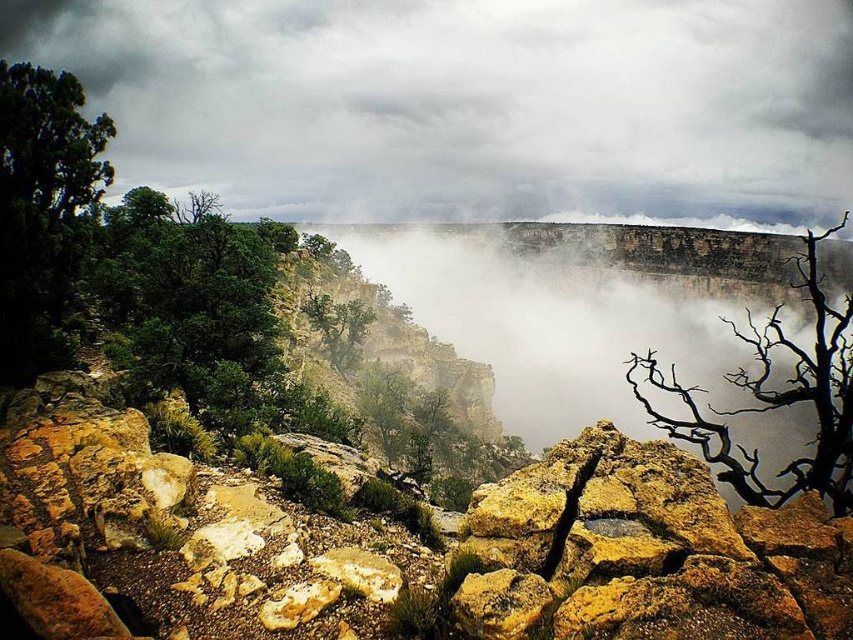
Question: Is foggy mist at center above green leafy tree at left?

Choices:
 (A) yes
 (B) no

Answer: (B)

Question: Observing the image, what is the correct spatial positioning of cloudy sky at upper center in reference to green leafy tree at left?

Choices:
 (A) below
 (B) above

Answer: (B)

Question: Based on their relative distances, which object is farther from the cloudy sky at upper center?

Choices:
 (A) green leafy tree at left
 (B) black deadwood at right

Answer: (B)

Question: Does foggy mist at center appear over black deadwood at right?

Choices:
 (A) no
 (B) yes

Answer: (B)

Question: Which point is closer to the camera taking this photo?

Choices:
 (A) (650, 83)
 (B) (802, 358)
 (C) (129, 291)
 (D) (544, 588)

Answer: (D)

Question: Which object is closer to the camera taking this photo?

Choices:
 (A) cloudy sky at upper center
 (B) foggy mist at center
 (C) yellowish rock at center
 (D) green leafy tree at left

Answer: (C)